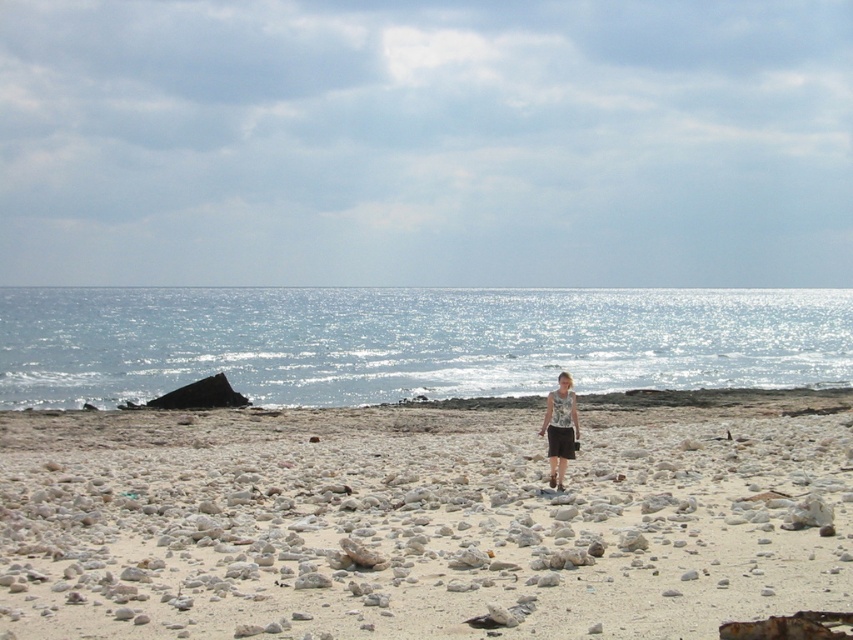
You are standing at the center of the beach scene. You see the matte gray tank top at center. Where exactly is it located in terms of coordinates?

The matte gray tank top at center is located at coordinates point (560,428).

You are standing on the beach and want to know if the glistening blue water at center is wider than the matte gray tank top at center. Can you determine this based on the scene?

The glistening blue water at center is wider than the matte gray tank top at center according to the scene description.

You are a photographer trying to capture the entire scene of the glistening blue water at center and the matte gray tank top at center in one shot. Given their sizes, which object will appear bigger in the photo?

The glistening blue water at center will appear bigger in the photo since it has a larger size compared to the matte gray tank top at center.